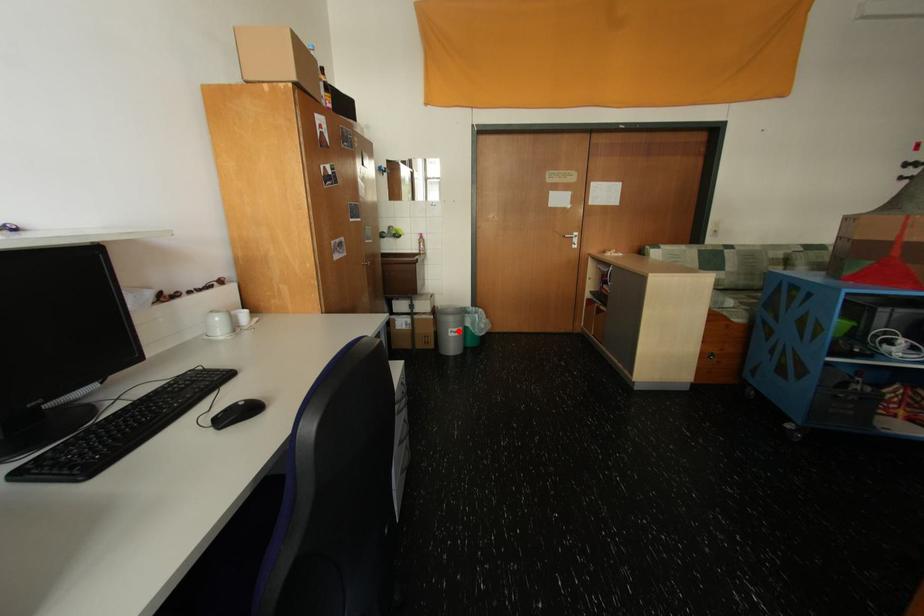
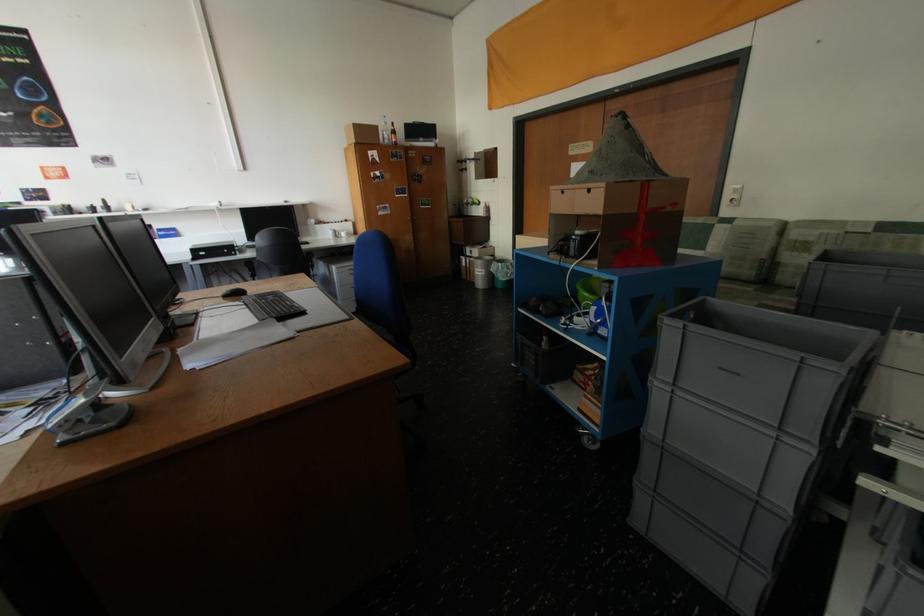
Question: I am providing you with two images of the same scene from different viewpoints. A red point is shown in image1. For the corresponding object point in image2, is it positioned nearer or farther from the camera?

Choices:
 (A) Nearer
 (B) Farther

Answer: (A)